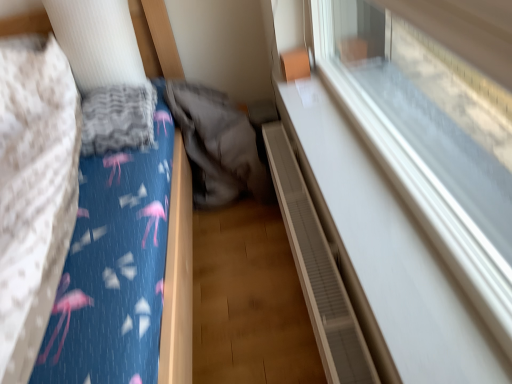
Locate an element on the screen. vacant region above brown textured radiator at lower right (from a real-world perspective) is located at coordinates click(x=310, y=218).